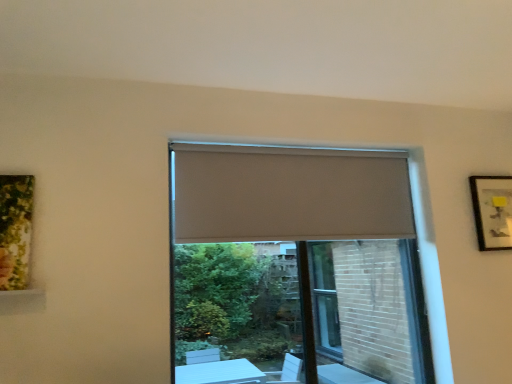
Question: Is point (349, 349) positioned closer to the camera than point (275, 236)?

Choices:
 (A) farther
 (B) closer

Answer: (A)

Question: Is matte gray screen door at center bigger or smaller than beige fabric curtain at center?

Choices:
 (A) small
 (B) big

Answer: (A)

Question: Which object is the farthest from the matte gray screen door at center?

Choices:
 (A) matte black picture frame at upper right
 (B) beige fabric curtain at center
 (C) beige fabric window at center

Answer: (B)

Question: Estimate the real-world distances between objects in this image. Which object is closer to the beige fabric curtain at center?

Choices:
 (A) matte black picture frame at upper right
 (B) beige fabric window at center
 (C) matte gray screen door at center

Answer: (A)